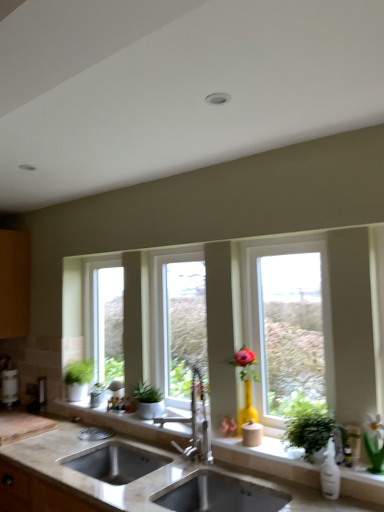
Question: Should I look upward or downward to see clear glass window at center, the first window positioned from the right?

Choices:
 (A) down
 (B) up

Answer: (A)

Question: Considering the relative sizes of green matte houseplant at lower left, which is counted as the third houseplant, starting from the right, and green matte flowerpot at left in the image provided, is green matte houseplant at lower left, which is counted as the third houseplant, starting from the right, wider than green matte flowerpot at left?

Choices:
 (A) yes
 (B) no

Answer: (A)

Question: Is green matte houseplant at lower left, the second houseplant viewed from the left, far from green matte flowerpot at left?

Choices:
 (A) no
 (B) yes

Answer: (A)

Question: Is green matte houseplant at lower left, the second houseplant viewed from the left, shorter than green matte flowerpot at left?

Choices:
 (A) no
 (B) yes

Answer: (A)

Question: Is green matte houseplant at lower left, the fourth houseplant from the front, next to green matte flowerpot at left and touching it?

Choices:
 (A) yes
 (B) no

Answer: (A)

Question: Is green matte houseplant at lower left, the second houseplant viewed from the left, taller than green matte flowerpot at left?

Choices:
 (A) yes
 (B) no

Answer: (A)

Question: Considering the relative positions of green matte houseplant at lower left, which is counted as the third houseplant, starting from the right, and green matte flowerpot at left in the image provided, is green matte houseplant at lower left, which is counted as the third houseplant, starting from the right, to the right of green matte flowerpot at left from the viewer's perspective?

Choices:
 (A) yes
 (B) no

Answer: (A)

Question: Could you tell me if clear glass window at center, the third window in the left-to-right sequence, is facing clear glass window at center, positioned as the 1th window in left-to-right order?

Choices:
 (A) yes
 (B) no

Answer: (B)

Question: Is clear glass window at center, the third window in the left-to-right sequence, positioned far away from clear glass window at center, acting as the 3th window starting from the front?

Choices:
 (A) no
 (B) yes

Answer: (B)

Question: Is clear glass window at center, the 3th window viewed from the back, facing away from clear glass window at center, which appears as the 3th window when viewed from the right?

Choices:
 (A) no
 (B) yes

Answer: (A)

Question: Can you confirm if clear glass window at center, the 3th window viewed from the back, is wider than clear glass window at center, which is the 1th window from back to front?

Choices:
 (A) yes
 (B) no

Answer: (A)

Question: Is clear glass window at center, the third window in the left-to-right sequence, smaller than clear glass window at center, which appears as the 3th window when viewed from the right?

Choices:
 (A) no
 (B) yes

Answer: (A)

Question: Can you confirm if clear glass window at center, the first window positioned from the right, is shorter than clear glass window at center, which is the 1th window from back to front?

Choices:
 (A) yes
 (B) no

Answer: (A)

Question: Is clear glass window at center, acting as the 3th window starting from the front, inside satin nickel faucet at center?

Choices:
 (A) yes
 (B) no

Answer: (B)